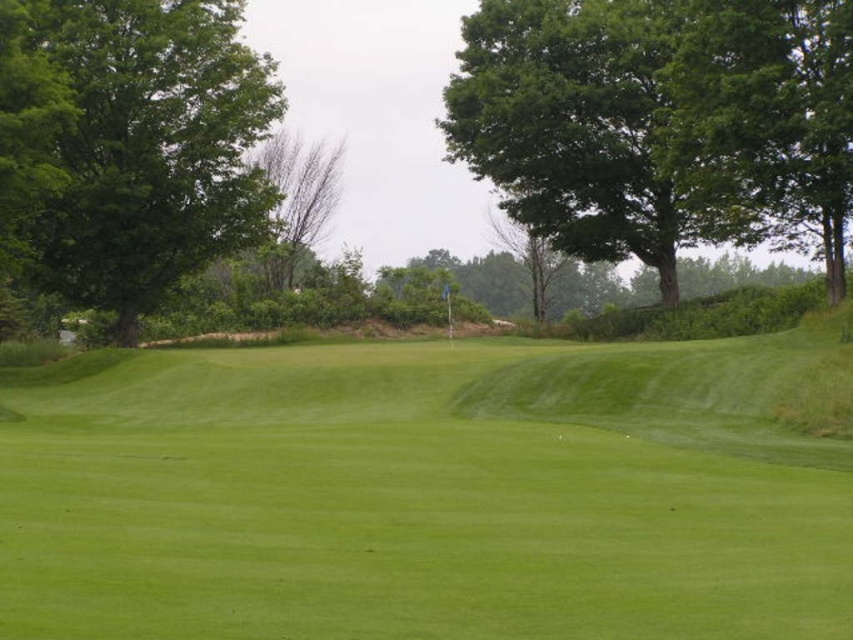
You are standing at the point closer to the camera in the golf course scene. Which point are you standing at, point (547, 141) or point (45, 273)?

You are standing at point (45, 273) because it is closer to the camera than point (547, 141).

Based on the photo, you are standing on a golf course and want to putt a golf ball from your current position to the hole located at point (685, 44). If the ball travels at a constant speed of 2 meters per second, how long will it take for the ball to reach the hole?

The distance between the viewer and the hole at point (685, 44) is 37.81 meters. At a speed of 2 meters per second, the time taken would be 37.81 divided by 2, which equals 18.905 seconds. Therefore, it will take approximately 18.9 seconds for the ball to reach the hole.

You are standing on the golf course and see two points marked on the ground. One is labeled as point (358,589) and the other as point (730,195). Which point is nearer to you?

Point (358,589) is closer to the viewer than point (730,195).